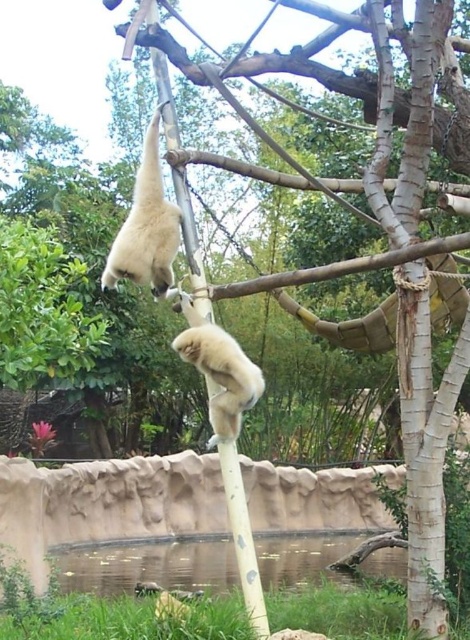
Question: Estimate the real-world distances between objects in this image. Which object is farther from the white matte pole at center?

Choices:
 (A) fuzzy white monkey at center
 (B) white fur monkey at upper center

Answer: (B)

Question: In this image, where is white matte pole at center located relative to fuzzy white monkey at center?

Choices:
 (A) above
 (B) below

Answer: (B)

Question: Is white matte pole at center wider than fuzzy white monkey at center?

Choices:
 (A) no
 (B) yes

Answer: (A)

Question: Based on their relative distances, which object is nearer to the fuzzy white monkey at center?

Choices:
 (A) white fur monkey at upper center
 (B) white matte pole at center

Answer: (A)

Question: Which point appears farthest from the camera in this image?

Choices:
 (A) (225, 486)
 (B) (161, 253)
 (C) (212, 333)

Answer: (B)

Question: Is white matte pole at center behind fuzzy white monkey at center?

Choices:
 (A) no
 (B) yes

Answer: (A)